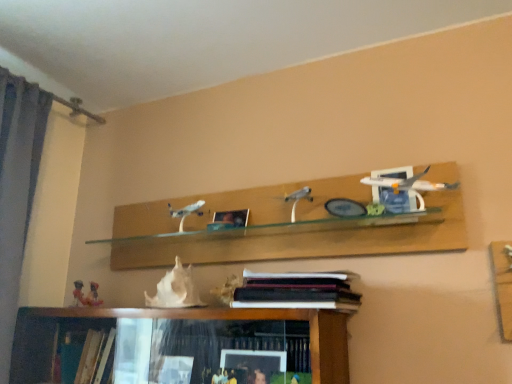
Question: Is metallic silver picture frame at center facing towards white matte seashell at center?

Choices:
 (A) no
 (B) yes

Answer: (A)

Question: Is metallic silver picture frame at center closer to the viewer compared to white matte seashell at center?

Choices:
 (A) yes
 (B) no

Answer: (B)

Question: From the image's perspective, is metallic silver picture frame at center under white matte seashell at center?

Choices:
 (A) no
 (B) yes

Answer: (A)

Question: Is metallic silver picture frame at center to the right of white matte seashell at center from the viewer's perspective?

Choices:
 (A) no
 (B) yes

Answer: (B)

Question: From a real-world perspective, is metallic silver picture frame at center over white matte seashell at center?

Choices:
 (A) yes
 (B) no

Answer: (A)

Question: Is white matte seashell at center completely or partially inside metallic silver picture frame at center?

Choices:
 (A) no
 (B) yes

Answer: (A)

Question: Considering the relative positions of metallic silver picture frame at center and white glossy airplane at upper right in the image provided, is metallic silver picture frame at center behind white glossy airplane at upper right?

Choices:
 (A) yes
 (B) no

Answer: (A)

Question: Is metallic silver picture frame at center completely or partially outside of white glossy airplane at upper right?

Choices:
 (A) no
 (B) yes

Answer: (B)

Question: Is metallic silver picture frame at center directly adjacent to white glossy airplane at upper right?

Choices:
 (A) yes
 (B) no

Answer: (B)

Question: Can you confirm if metallic silver picture frame at center is shorter than white glossy airplane at upper right?

Choices:
 (A) yes
 (B) no

Answer: (A)

Question: Is metallic silver picture frame at center far from white glossy airplane at upper right?

Choices:
 (A) yes
 (B) no

Answer: (B)

Question: Does metallic silver picture frame at center turn towards white glossy airplane at upper right?

Choices:
 (A) no
 (B) yes

Answer: (A)

Question: Is white matte seashell at center shorter than white glossy airplane at upper right?

Choices:
 (A) no
 (B) yes

Answer: (A)